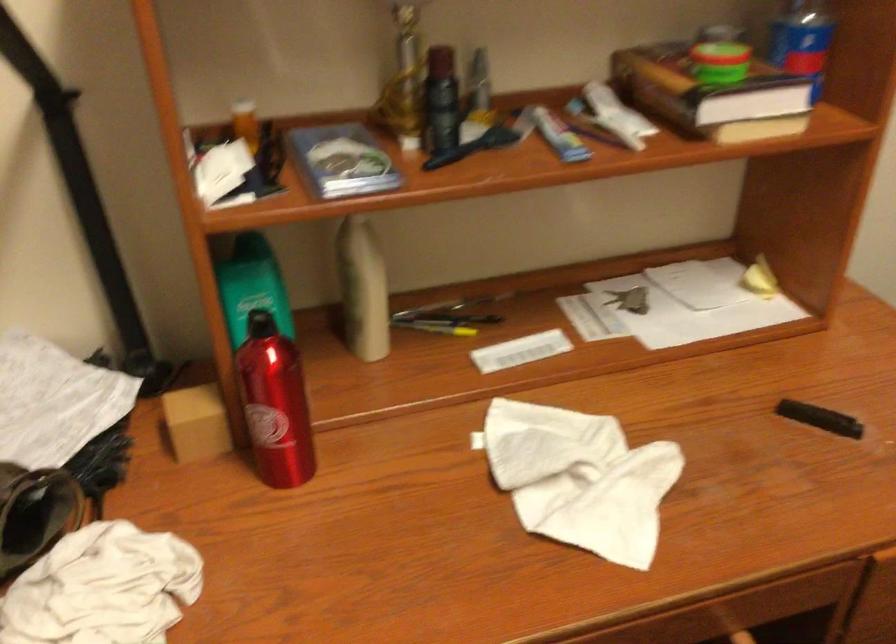
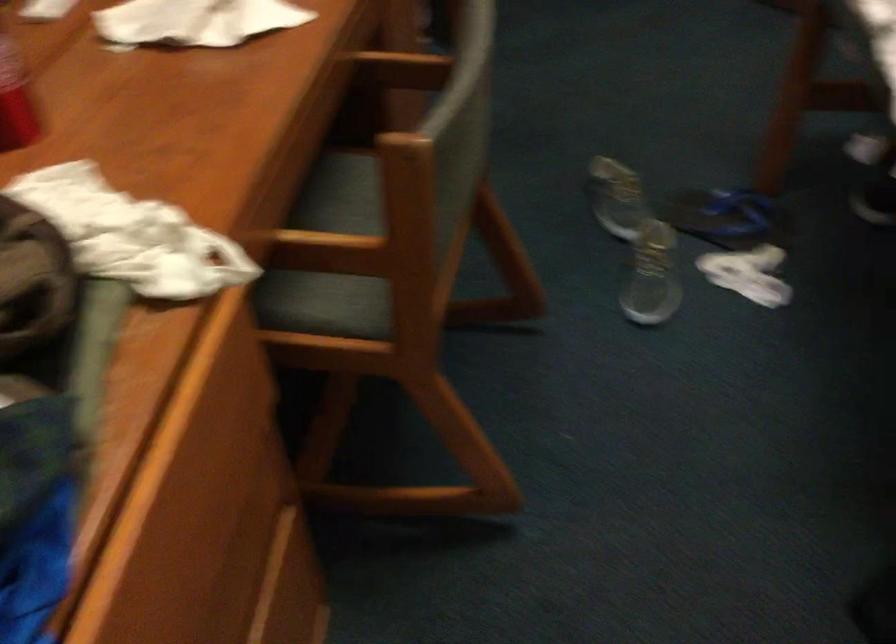
How did the camera likely rotate?

The camera's rotation is toward right-down.